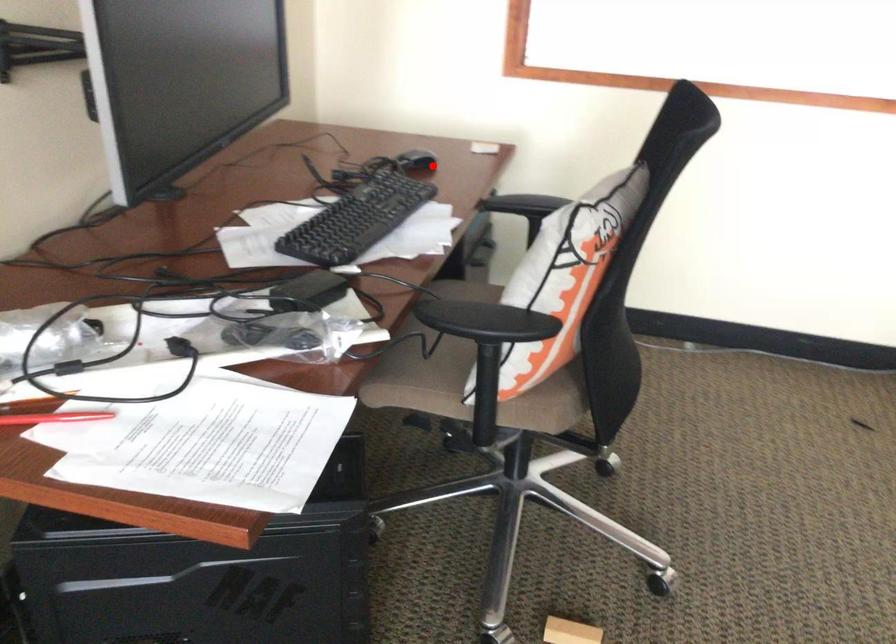
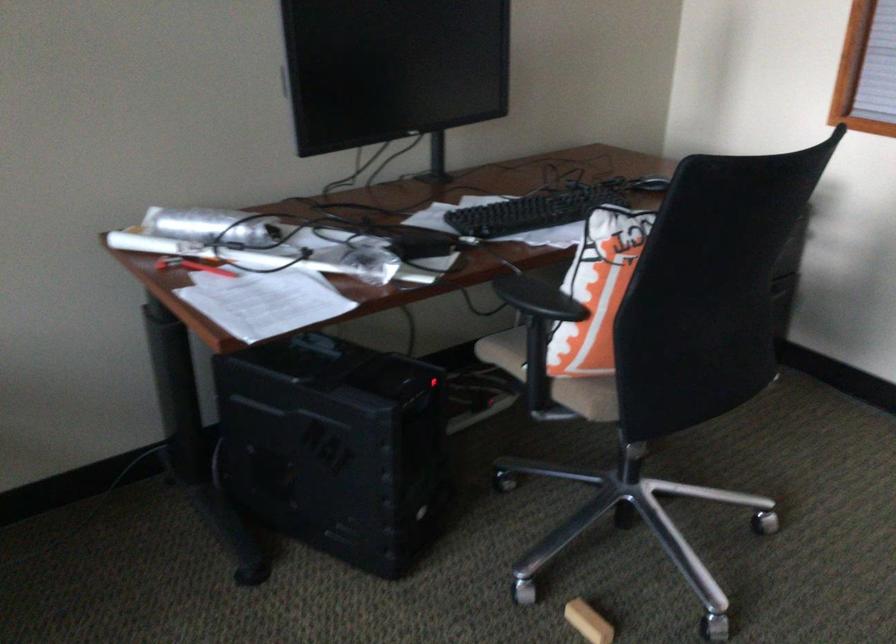
In the second image, find the point that corresponds to the highlighted location in the first image.

(648, 185)